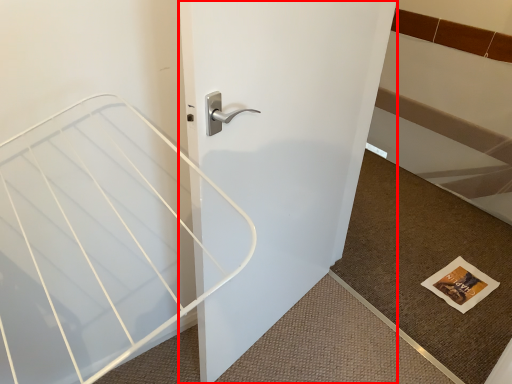
Question: Where is door (annotated by the red box) located in relation to doormat in the image?

Choices:
 (A) left
 (B) right

Answer: (A)